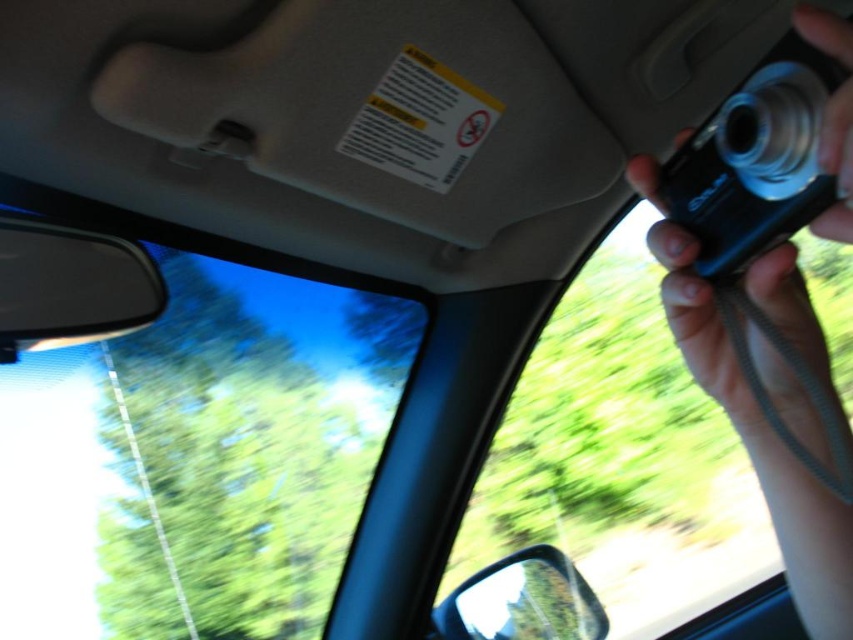
Is transparent glass car window at upper left above black plastic car mirror at left?

Actually, transparent glass car window at upper left is below black plastic car mirror at left.

Is transparent glass car window at upper left thinner than black plastic car mirror at left?

No, transparent glass car window at upper left is not thinner than black plastic car mirror at left.

The image size is (853, 640). What are the coordinates of `transparent glass car window at upper left` in the screenshot? It's located at (196, 460).

What are the coordinates of `transparent glass car window at upper left` in the screenshot? It's located at (196, 460).

Which is more to the right, transparent plastic car window at right or black plastic car mirror at left?

transparent plastic car window at right

Find the location of a particular element. transparent plastic car window at right is located at coordinates (619, 458).

Based on the photo, who is more forward, (636, 522) or (68, 323)?

Point (68, 323) is in front.

This screenshot has height=640, width=853. What are the coordinates of `transparent plastic car window at right` in the screenshot? It's located at (619, 458).

Can you confirm if transparent glass car window at upper left is shorter than shiny silver mirror at lower right?

In fact, transparent glass car window at upper left may be taller than shiny silver mirror at lower right.

Is transparent glass car window at upper left below shiny silver mirror at lower right?

Incorrect, transparent glass car window at upper left is not positioned below shiny silver mirror at lower right.

Which is in front, point (103, 388) or point (489, 573)?

Point (489, 573)

Find the location of a particular element. transparent glass car window at upper left is located at coordinates (196, 460).